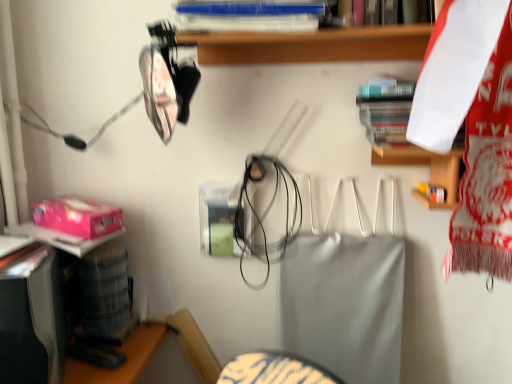
Question: Relative to hardcover book at upper right, which ranks as the 1th book in bottom-to-top order, is blue plastic book at upper center, the 1th book when ordered from left to right, in front or behind?

Choices:
 (A) behind
 (B) front

Answer: (B)

Question: From a real-world perspective, is blue plastic book at upper center, which is the second book in bottom-to-top order, positioned above or below hardcover book at upper right, arranged as the 1th book when viewed from the right?

Choices:
 (A) above
 (B) below

Answer: (A)

Question: Which is nearer to the hardcover book at upper right, arranged as the 1th book when viewed from the right?

Choices:
 (A) blue plastic book at upper center, positioned as the first book in top-to-bottom order
 (B) white plastic shelf at upper center
 (C) pink matte box at lower left

Answer: (B)

Question: Which is farther from the pink matte box at lower left?

Choices:
 (A) white plastic shelf at upper center
 (B) hardcover book at upper right, which appears as the 2th book when viewed from the left
 (C) blue plastic book at upper center, the 1th book when ordered from left to right

Answer: (B)